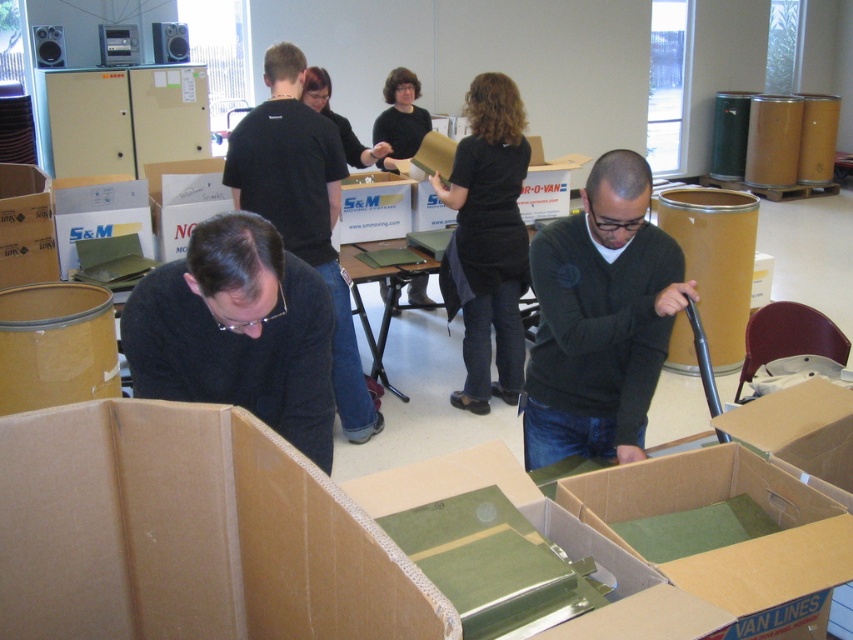
You are organizing items in a storage room and need to place the green cardboard box at left and the matte black shirt at center into a storage container. Which object should you place first if you want to maximize space efficiency?

The green cardboard box at left has a smaller size compared to the matte black shirt at center, so you should place the matte black shirt at center first to allow the smaller box to fit into any remaining space.

You are organizing a clothing donation drive and need to determine which item takes up more space horizontally. Which of the two items, the black matte sweater at lower left or the black matte shirt at upper center, is wider?

The black matte shirt at upper center is wider than the black matte sweater at lower left.

What are the coordinates of the black matte shirt at center?

The coordinates of the black matte shirt at center are [486,241].